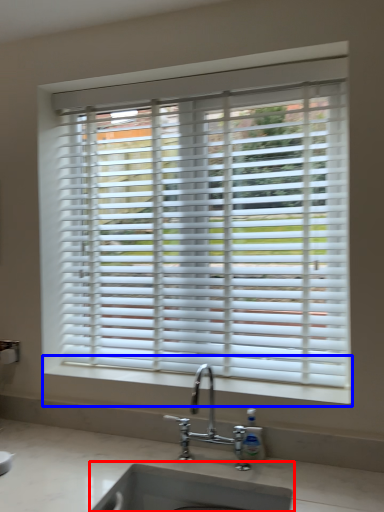
Question: Which object is further to the camera taking this photo, sink (highlighted by a red box) or window sill (highlighted by a blue box)?

Choices:
 (A) sink
 (B) window sill

Answer: (B)